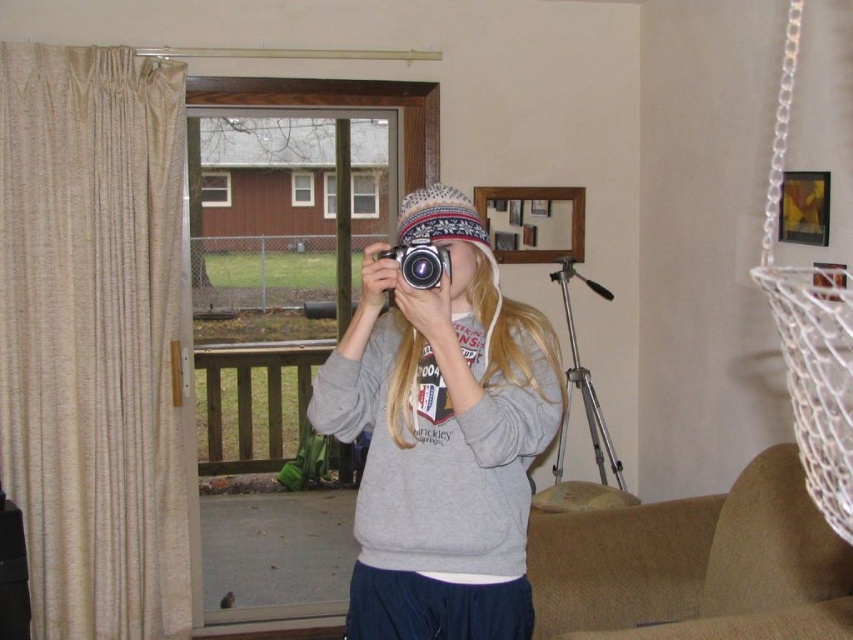
Between point (415, 396) and point (606, 433), which one is positioned in front?

Point (415, 396) is in front.

Can you confirm if gray fleece sweatshirt at center is positioned to the left of silver metallic tripod at right?

Indeed, gray fleece sweatshirt at center is positioned on the left side of silver metallic tripod at right.

Which is in front, point (502, 449) or point (567, 326)?

Point (502, 449) is more forward.

The width and height of the screenshot is (853, 640). In order to click on gray fleece sweatshirt at center in this screenshot , I will do `click(440, 435)`.

Can you confirm if gray fleece sweatshirt at center is positioned to the right of white mesh swing at upper right?

Incorrect, gray fleece sweatshirt at center is not on the right side of white mesh swing at upper right.

Which of these two, gray fleece sweatshirt at center or white mesh swing at upper right, stands taller?

white mesh swing at upper right

Where is `gray fleece sweatshirt at center`? The image size is (853, 640). gray fleece sweatshirt at center is located at coordinates (440, 435).

Is point (428, 544) closer to viewer compared to point (440, 259)?

No, (428, 544) is behind (440, 259).

Does point (457, 472) lie in front of point (425, 262)?

No, it is not.

Find the location of `gray fleece sweatshirt at center`. gray fleece sweatshirt at center is located at coordinates (440, 435).